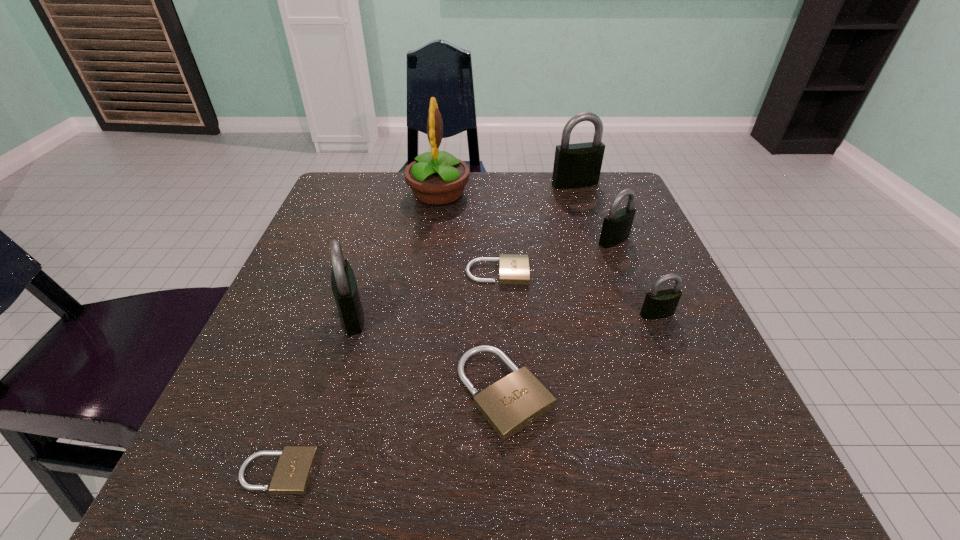
Where is `the sixth farthest padlock`? This screenshot has height=540, width=960. the sixth farthest padlock is located at coordinates (x=509, y=405).

The image size is (960, 540). In order to click on the sixth tallest object in this screenshot , I will do `click(509, 405)`.

Identify the location of the fifth nearest padlock. (513, 269).

The height and width of the screenshot is (540, 960). I want to click on the second shortest object, so click(513, 269).

I want to click on the shortest object, so click(292, 475).

Find the location of a particular element. The height and width of the screenshot is (540, 960). the nearest beige padlock is located at coordinates (292, 475).

Identify the location of blank space located 0.130m on the face of the yellow sunflower. Image resolution: width=960 pixels, height=540 pixels. (524, 194).

Identify the location of vacant region located on the front of the farthest black padlock. The width and height of the screenshot is (960, 540). (590, 232).

Where is `vacant space positioned 0.310m on the right of the second tallest padlock`? Image resolution: width=960 pixels, height=540 pixels. vacant space positioned 0.310m on the right of the second tallest padlock is located at coordinates (546, 315).

At what (x,y) coordinates should I click in order to perform the action: click on vacant space situated 0.220m on the left of the second smallest black padlock. Please return your answer as a coordinate pair (x, y). This screenshot has height=540, width=960. Looking at the image, I should click on (492, 240).